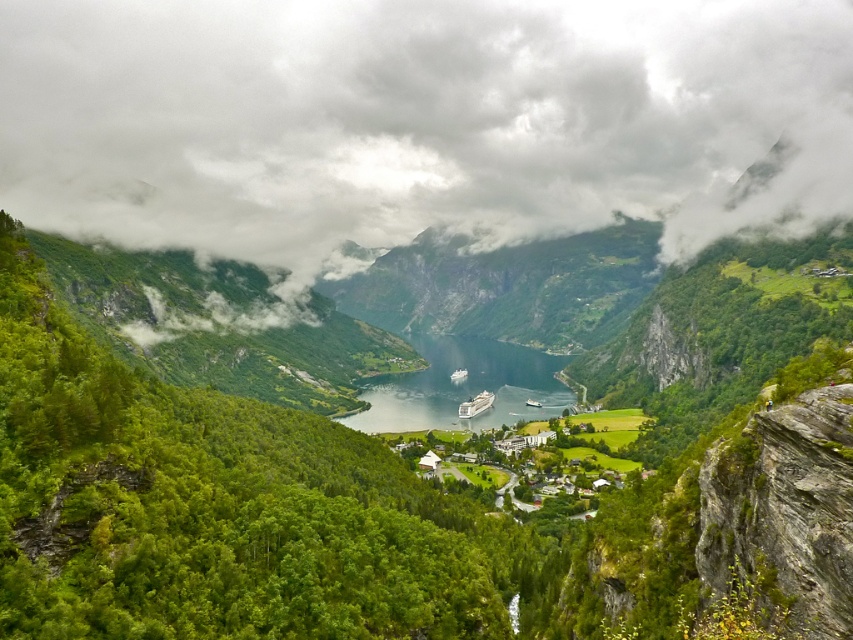
Does clear blue water at center have a smaller size compared to white glossy cruise ship at center?

Incorrect, clear blue water at center is not smaller in size than white glossy cruise ship at center.

Is clear blue water at center below white glossy cruise ship at center?

No.

Image resolution: width=853 pixels, height=640 pixels. I want to click on clear blue water at center, so click(x=463, y=387).

Which of these two, cloudy sky at center or white glossy cruise ship at center, stands taller?

cloudy sky at center is taller.

Is point (24, 97) closer to viewer compared to point (485, 401)?

That is False.

The width and height of the screenshot is (853, 640). What do you see at coordinates (421, 122) in the screenshot?
I see `cloudy sky at center` at bounding box center [421, 122].

Identify the location of cloudy sky at center. (421, 122).

Consider the image. Who is shorter, cloudy sky at center or clear blue water at center?

clear blue water at center is shorter.

Which is behind, point (62, 232) or point (395, 378)?

Point (395, 378)

Identify the location of cloudy sky at center. The height and width of the screenshot is (640, 853). (421, 122).